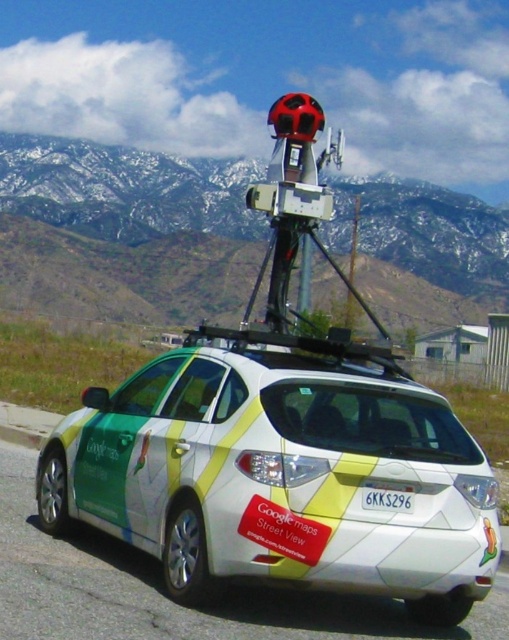
Question: Among these objects, which one is nearest to the camera?

Choices:
 (A) snowy rock mountain at upper center
 (B) white glossy car at center
 (C) white plastic license plate at rear

Answer: (B)

Question: Is white glossy car at center above snowy rock mountain at upper center?

Choices:
 (A) no
 (B) yes

Answer: (A)

Question: Which point appears farthest from the camera in this image?

Choices:
 (A) (70, 198)
 (B) (145, 550)
 (C) (365, 497)

Answer: (A)

Question: Does snowy rock mountain at upper center appear over white plastic license plate at rear?

Choices:
 (A) yes
 (B) no

Answer: (A)

Question: Which object is positioned closest to the white glossy car at center?

Choices:
 (A) snowy rock mountain at upper center
 (B) white plastic license plate at rear

Answer: (B)

Question: Can you confirm if white glossy car at center is positioned above snowy rock mountain at upper center?

Choices:
 (A) yes
 (B) no

Answer: (B)